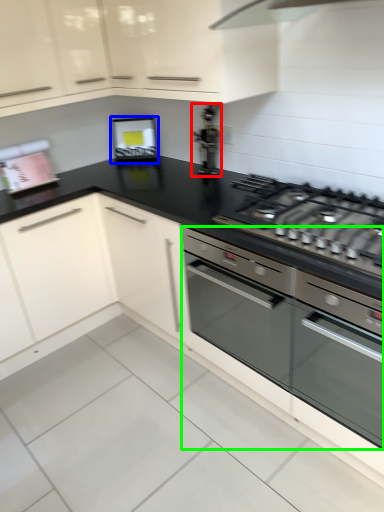
Question: Which object is positioned farthest from appliance (highlighted by a red box)? Select from appliance (highlighted by a blue box) and home appliance (highlighted by a green box).

Choices:
 (A) appliance
 (B) home appliance

Answer: (B)